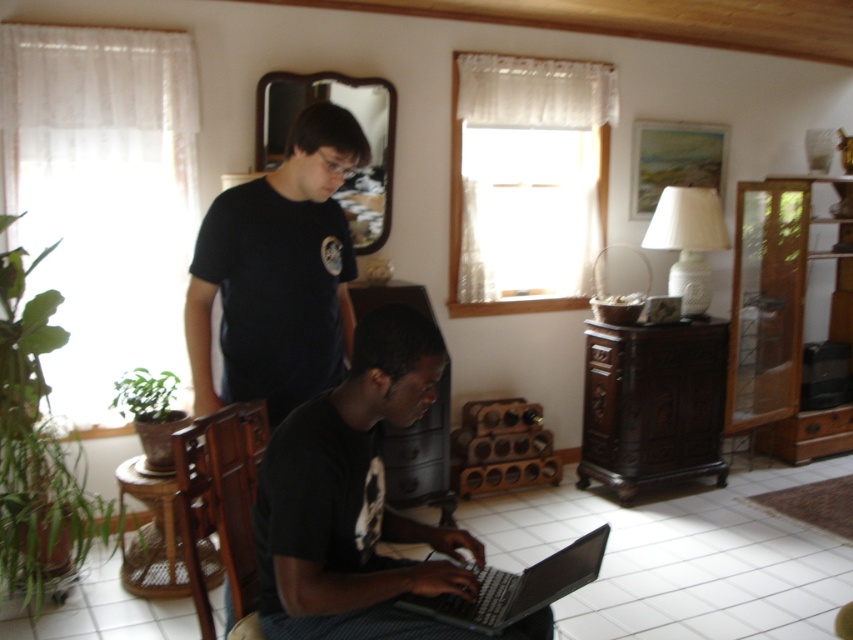
Which is above, wooden chair at center or silver metallic laptop at lower center?

wooden chair at center

You are a GUI agent. You are given a task and a screenshot of the screen. Output one action in this format:
    pyautogui.click(x=<x>, y=<y>)
    Task: Click on the wooden chair at center
    The image size is (853, 640).
    Given the screenshot: What is the action you would take?
    pyautogui.click(x=219, y=500)

Can you confirm if black matte laptop at lower center is positioned below black matte shirt at upper left?

Yes.

Is point (308, 612) farther from viewer compared to point (276, 340)?

No.

At what (x,y) coordinates should I click in order to perform the action: click on black matte laptop at lower center. Please return your answer as a coordinate pair (x, y). Image resolution: width=853 pixels, height=640 pixels. Looking at the image, I should click on (354, 499).

Which is behind, point (403, 522) or point (190, 429)?

Point (403, 522)

Does point (357, 426) lie behind point (241, 422)?

No, it is not.

Locate an element on the screen. black matte laptop at lower center is located at coordinates (354, 499).